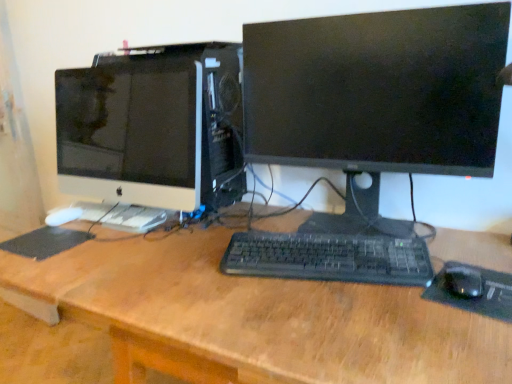
This screenshot has width=512, height=384. What are the coordinates of `free space in front of white glossy computer monitor at left, positioned as the 1th computer monitor in left-to-right order` in the screenshot? It's located at (151, 238).